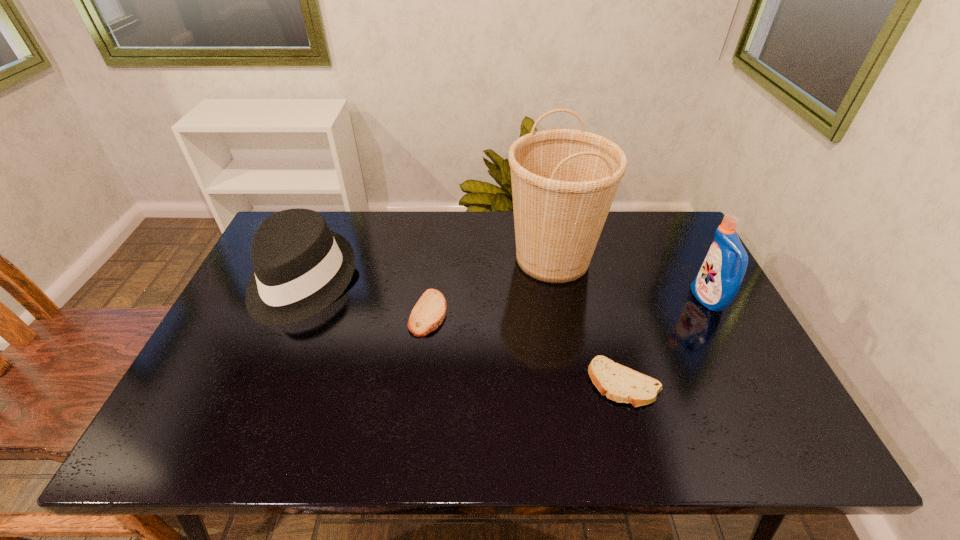
The height and width of the screenshot is (540, 960). I want to click on object located at the far left corner, so [301, 267].

Find the location of a particular element. The height and width of the screenshot is (540, 960). free space at the far edge is located at coordinates (377, 241).

Where is `vacant space at the near edge of the desktop`? vacant space at the near edge of the desktop is located at coordinates (389, 431).

Locate an element on the screen. This screenshot has width=960, height=540. vacant space at the left edge is located at coordinates (246, 340).

Image resolution: width=960 pixels, height=540 pixels. What are the coordinates of `vacant area at the right edge of the desktop` in the screenshot? It's located at (685, 284).

Identify the location of free space at the far left corner of the desktop. [x=324, y=214].

In the image, there is a desktop. In order to click on vacant space at the far right corner in this screenshot , I will do `click(638, 218)`.

You are a GUI agent. You are given a task and a screenshot of the screen. Output one action in this format:
    pyautogui.click(x=<x>, y=<y>)
    Task: Click on the free point between the fedora and the detergent
    
    Given the screenshot: What is the action you would take?
    pyautogui.click(x=505, y=291)

Locate an element on the screen. free space that is in between the second tallest object and the basket is located at coordinates (630, 279).

Where is `free spot between the rightmost object and the right pita bread`? free spot between the rightmost object and the right pita bread is located at coordinates pos(666,341).